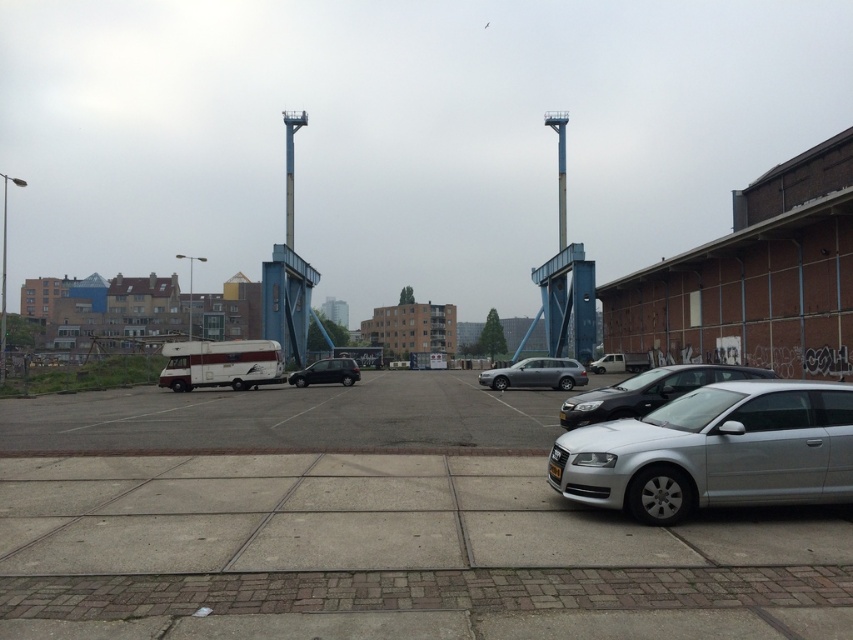
Can you confirm if satin silver sedan at center is taller than white matte van at center?

No, satin silver sedan at center is not taller than white matte van at center.

Identify the location of satin silver sedan at center. (537, 374).

Does silver metallic car at lower right appear on the left side of satin silver sedan at center?

Correct, you'll find silver metallic car at lower right to the left of satin silver sedan at center.

Which is more to the left, silver metallic car at lower right or satin silver sedan at center?

From the viewer's perspective, silver metallic car at lower right appears more on the left side.

Is point (738, 484) behind point (525, 369)?

No.

At what (x,y) coordinates should I click in order to perform the action: click on silver metallic car at lower right. Please return your answer as a coordinate pair (x, y). The height and width of the screenshot is (640, 853). Looking at the image, I should click on (714, 451).

Is silver metallic car at center positioned before satin silver sedan at center?

That is True.

Describe the element at coordinates (648, 392) in the screenshot. This screenshot has width=853, height=640. I see `silver metallic car at center` at that location.

Is point (624, 396) positioned behind point (552, 388)?

No, it is in front of (552, 388).

Locate an element on the screen. This screenshot has width=853, height=640. silver metallic car at center is located at coordinates (648, 392).